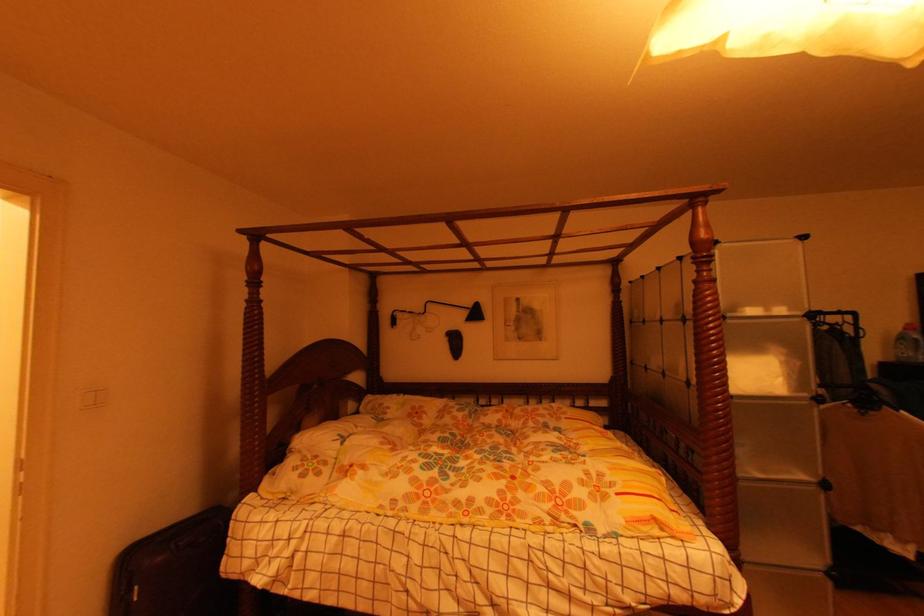
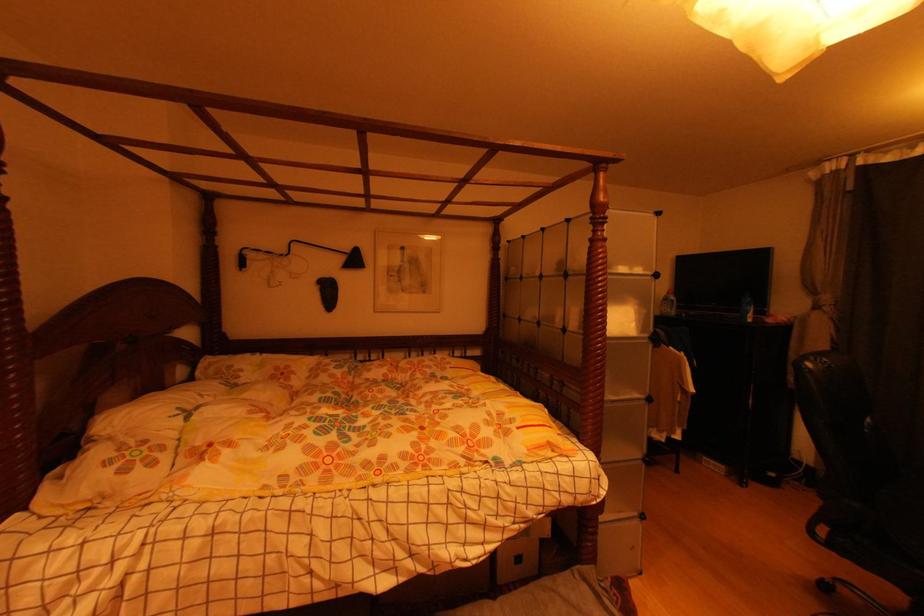
Which direction would the cameraman need to move to produce the second image?

The movement direction of the cameraman is left, forward.